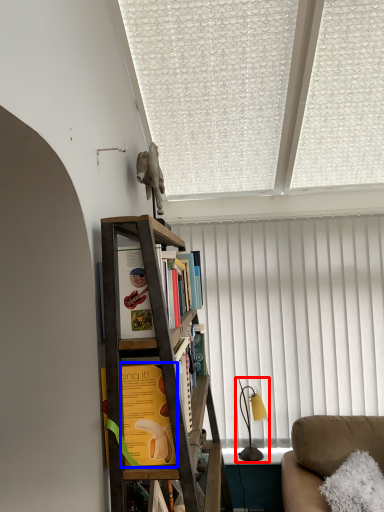
Question: Which object appears farthest to the camera in this image, table lamp (highlighted by a red box) or book (highlighted by a blue box)?

Choices:
 (A) table lamp
 (B) book

Answer: (A)